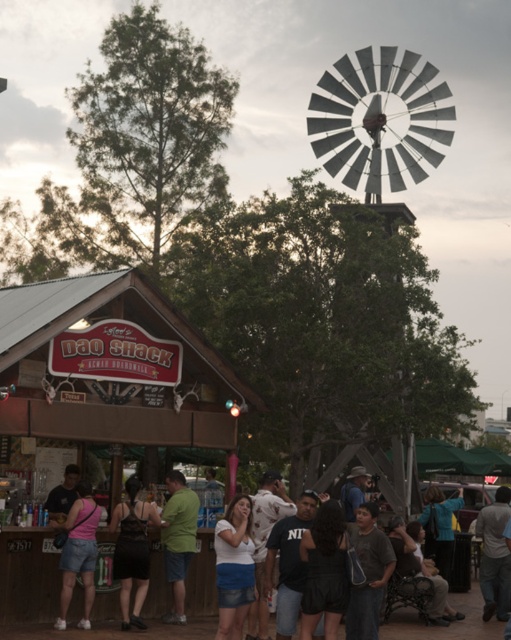
You are a photographer trying to capture a candid shot of both the matte gray shirt at lower center and the green cotton shirt at center. Since you want to ensure both subjects are in focus, you need to know which one is closer to the camera. Can you determine which shirt is nearer to the camera based on their heights?

The matte gray shirt at lower center has a lesser height compared to the green cotton shirt at center, which indicates it is closer to the camera. Therefore, the matte gray shirt at lower center is nearer to the camera.

You are a photographer trying to capture a candid shot of both the black mesh tank top at lower left and the gray cotton shirt at lower right. Since you can only focus on one person at a time, which person should you adjust your camera to focus on first if you want to ensure both are in the frame without moving your position?

You should focus on the black mesh tank top at lower left first because it is positioned to the left of the gray cotton shirt at lower right, so by starting with the leftmost subject, you can adjust your camera to include both in the frame without needing to reposition yourself.

You are standing at the camera position in the scene. Can you see the white cotton shirt at center clearly?

The white cotton shirt at center and camera are 44.73 meters apart from each other, so you cannot see the white cotton shirt at center clearly from that distance.